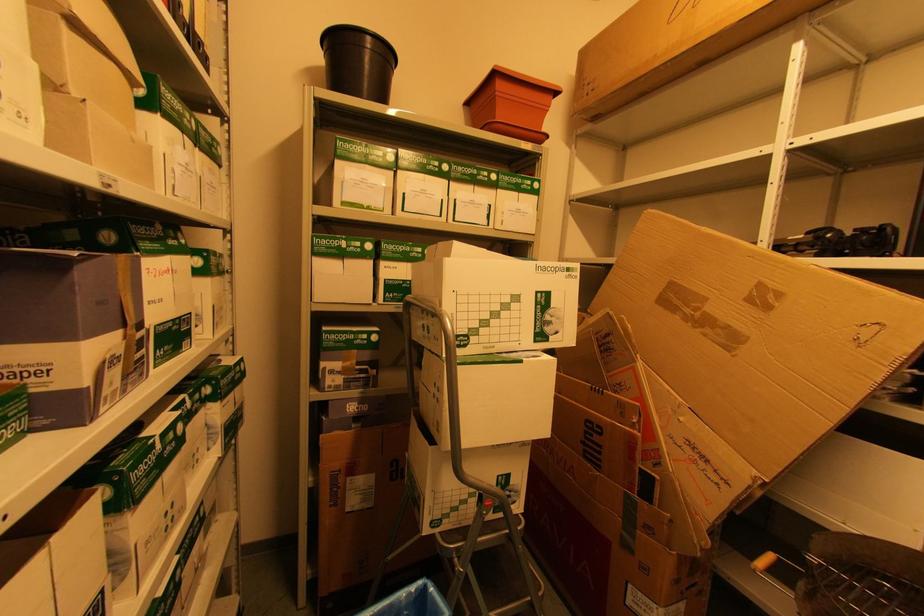
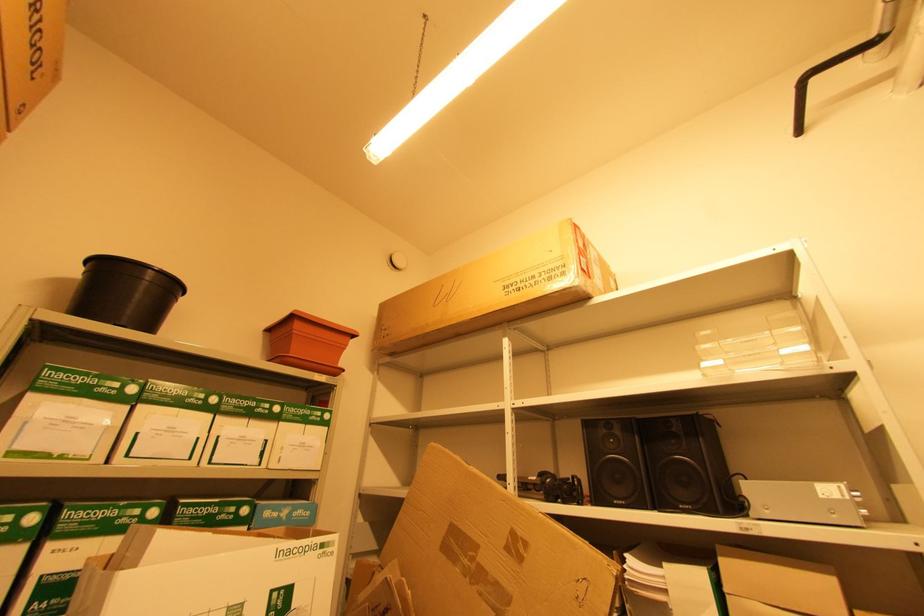
The images are taken continuously from a first-person perspective. In which direction is your viewpoint rotating?

The rotation direction of the camera is right-up.